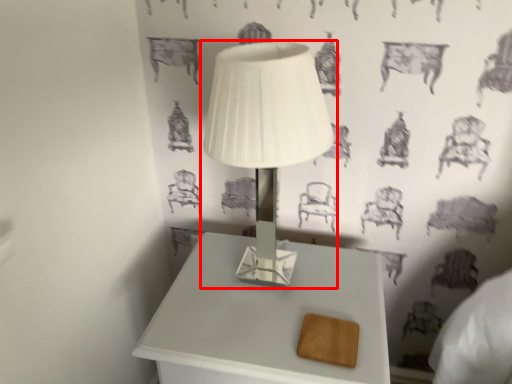
Question: In this image, where is lamp (annotated by the red box) located relative to table?

Choices:
 (A) right
 (B) left

Answer: (B)